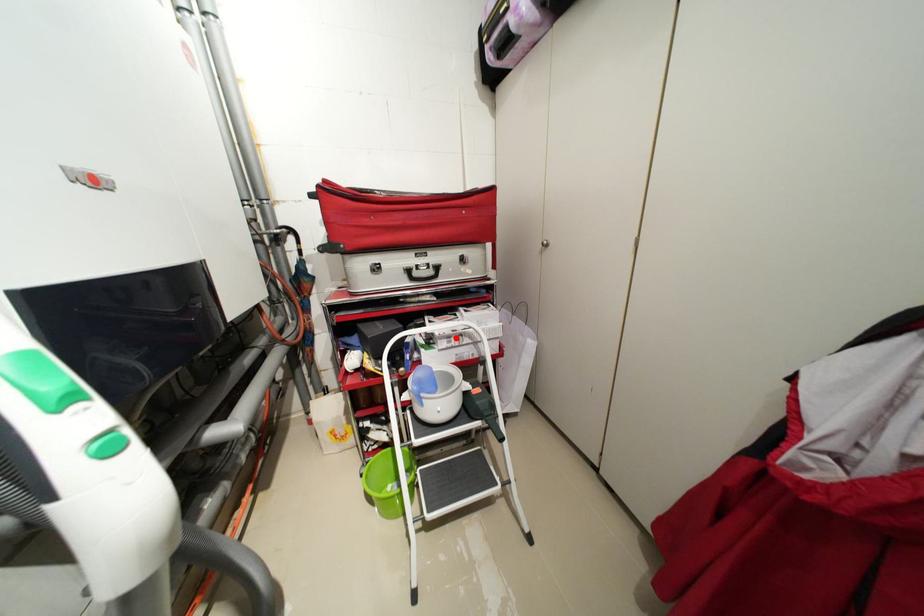
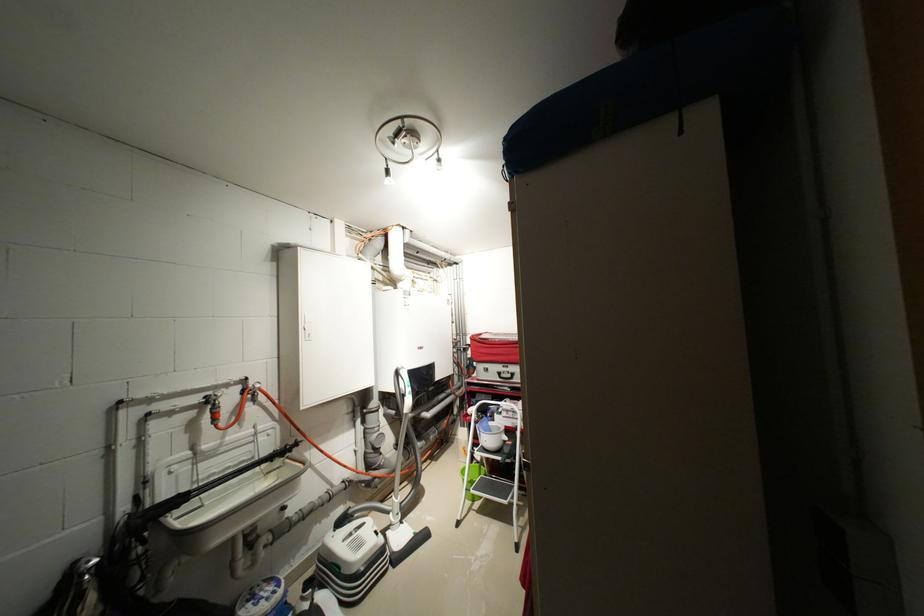
Question: I am providing you with two images of the same scene from different viewpoints. A red point is shown in image1. For the corresponding object point in image2, is it positioned nearer or farther from the camera?

Choices:
 (A) Nearer
 (B) Farther

Answer: (B)